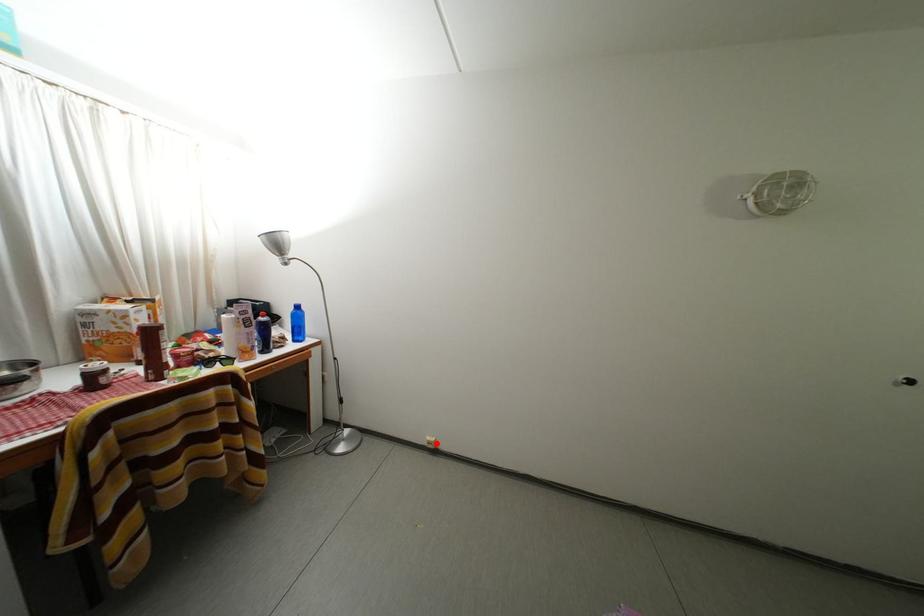
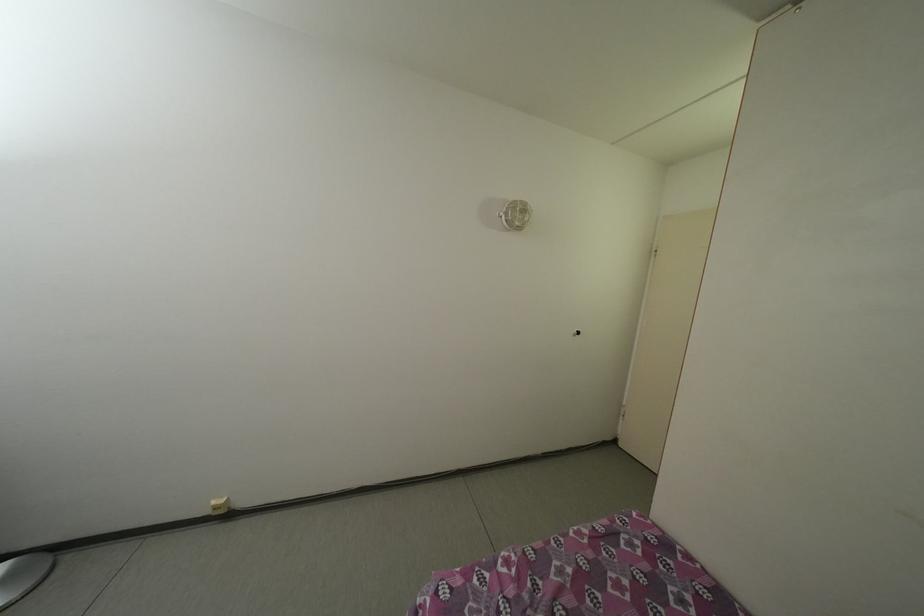
Question: I am providing you with two images of the same scene from different viewpoints. Image1 has a red point marked. In image2, the corresponding 3D location appears at what relative position? Reply with the corresponding letter.

Choices:
 (A) Closer
 (B) Farther

Answer: (A)